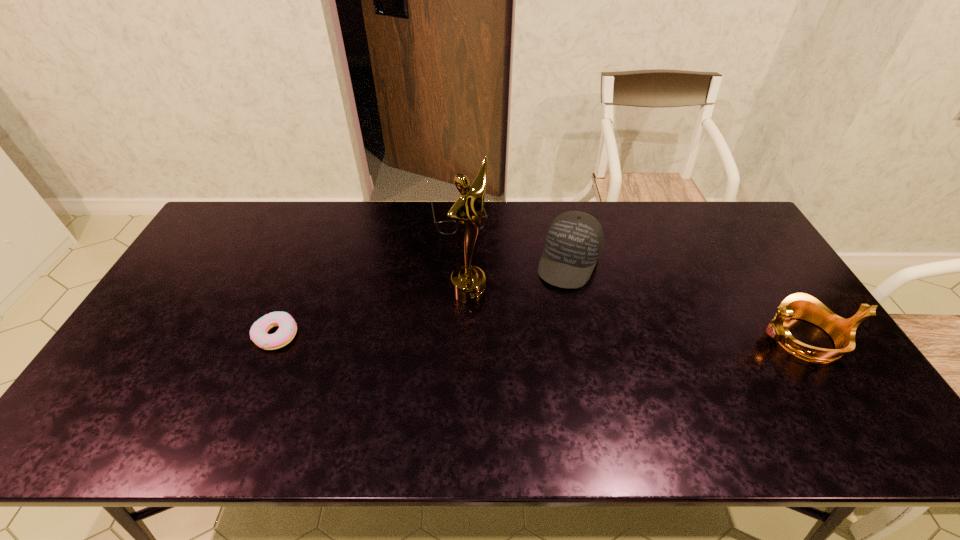
Locate an element on the screen. free space that satisfies the following two spatial constraints: 1. on the front side of the second object from right to left; 2. at the front emblem of the tiara is located at coordinates (585, 339).